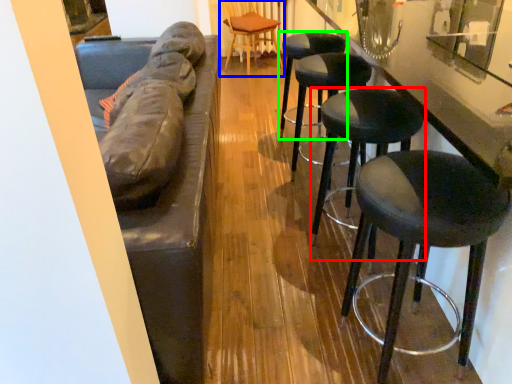
Question: Considering the real-world distances, which object is farthest from stool (highlighted by a red box)? chair (highlighted by a blue box) or stool (highlighted by a green box)?

Choices:
 (A) chair
 (B) stool

Answer: (A)